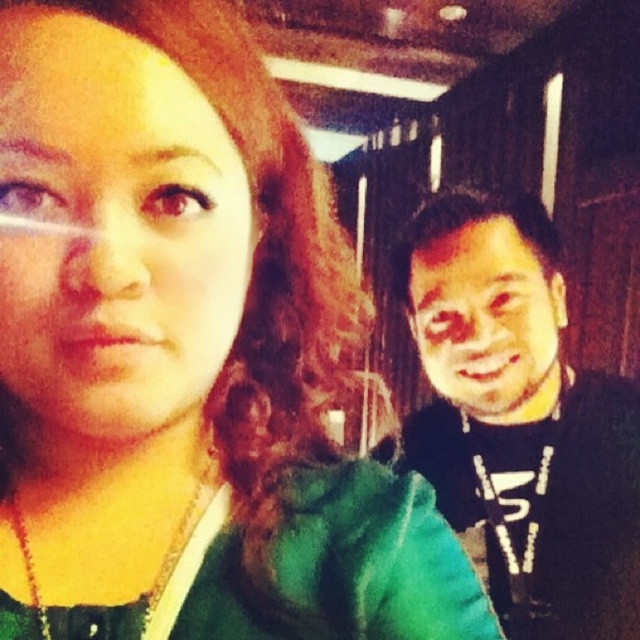
You are organizing a clothing store and need to arrange the matte green shirt at left and the black matte shirt at right on a rack. If the rack has limited space, which shirt should you place first to ensure both fit?

The matte green shirt at left has a smaller width than the black matte shirt at right. Place the wider black matte shirt at right first to accommodate its larger size, then fit the narrower matte green shirt at left next.

You are a photographer adjusting lighting in a dim room. You notice the black matte shirt at right and the smooth skin face at right in your frame. Which object should you focus on to ensure proper exposure, considering one is taller than the other?

The black matte shirt at right is taller than the smooth skin face at right, so focusing on the black matte shirt at right would ensure proper exposure since it occupies more vertical space in the frame.

You are taking a selfie and want to ensure both the matte green shirt at left and the smooth skin face at right are clearly visible. Which object is closer to the camera?

The matte green shirt at left is positioned over the smooth skin face at right, meaning it is closer to the camera.